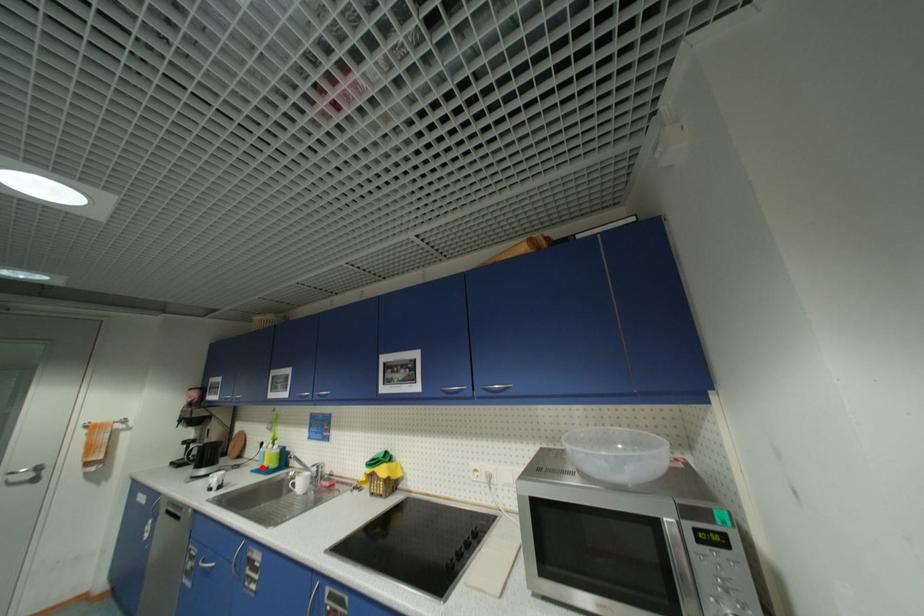
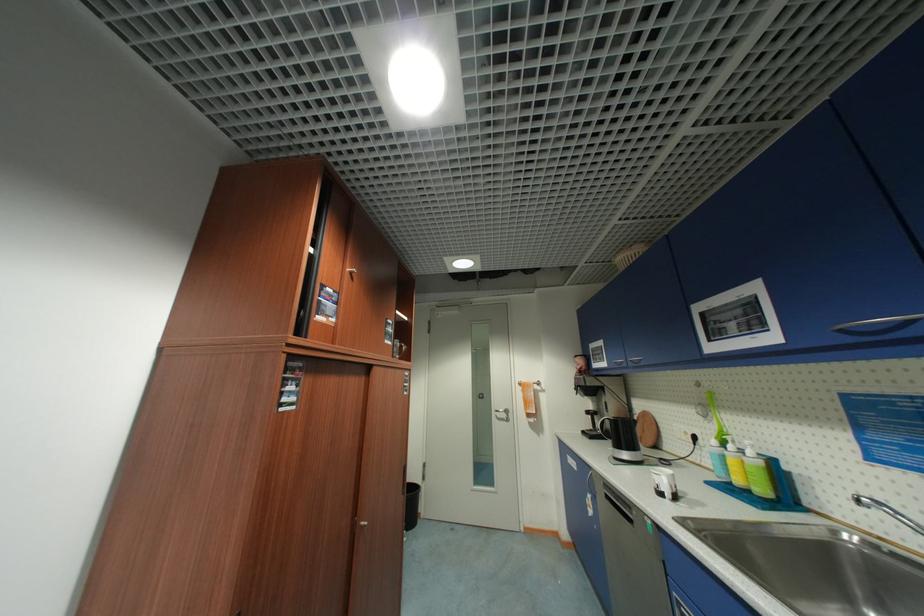
Question: I am providing you with two images of the same scene from different viewpoints. Given a red point in image1, look at the same physical point in image2. Is it:

Choices:
 (A) Closer to the viewpoint
 (B) Farther from the viewpoint

Answer: (A)